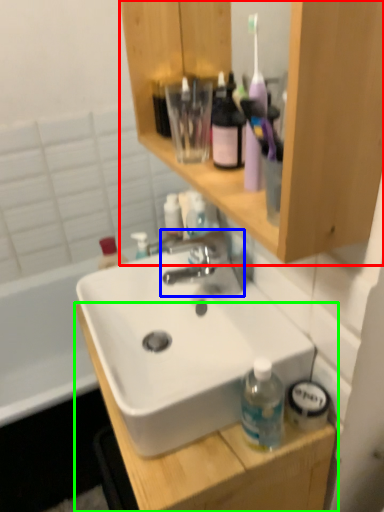
Question: Based on their relative distances, which object is nearer to bathroom cabinet (highlighted by a red box)? Choose from tap (highlighted by a blue box) and cabinetry (highlighted by a green box).

Choices:
 (A) tap
 (B) cabinetry

Answer: (A)